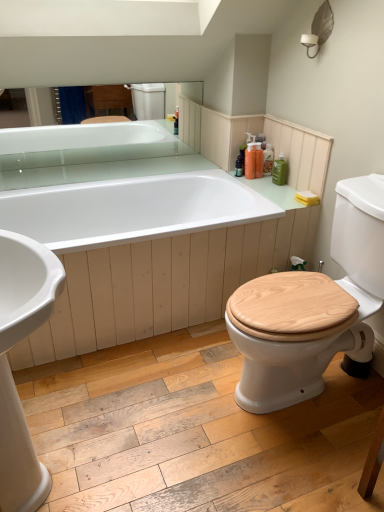
The height and width of the screenshot is (512, 384). In order to click on vacant area situated below wooden at right (from a real-world perspective) in this screenshot , I will do `click(321, 398)`.